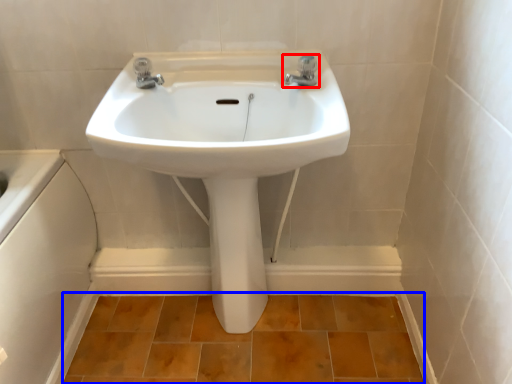
Question: Which of the following is the farthest to the observer, tap (highlighted by a red box) or ceramic tile (highlighted by a blue box)?

Choices:
 (A) tap
 (B) ceramic tile

Answer: (B)